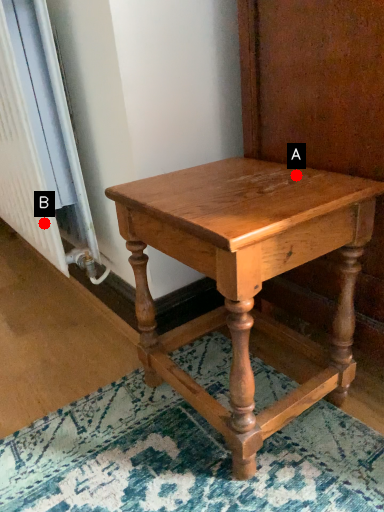
Question: Two points are circled on the image, labeled by A and B beside each circle. Which point is further to the camera?

Choices:
 (A) A is further
 (B) B is further

Answer: (B)